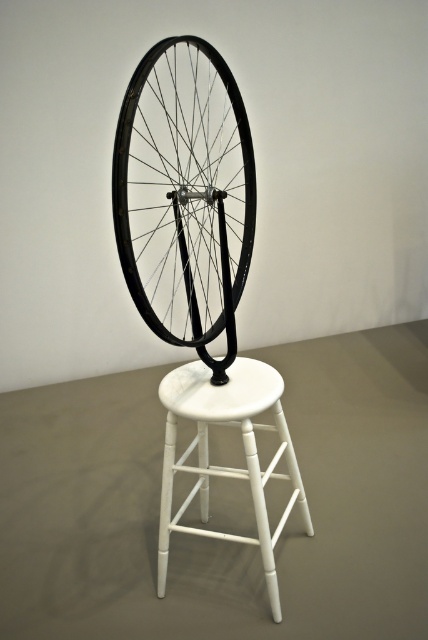
What do you see at coordinates (183, 188) in the screenshot?
I see `black matte bicycle wheel at center` at bounding box center [183, 188].

Identify the location of black matte bicycle wheel at center. (183, 188).